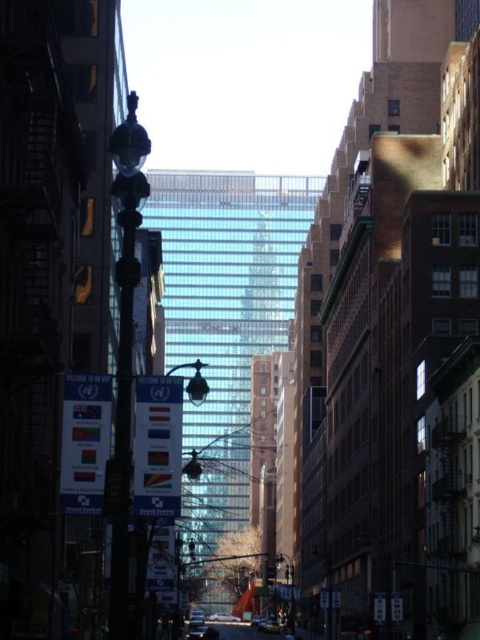
You are a delivery driver needing to park your truck, which is 6 meters long, between the black glass lamp post at center and the silver metallic sedan at center. Is there enough space for your truck?

The distance between the black glass lamp post at center and the silver metallic sedan at center is 55.20 meters. Since your truck is only 6 meters long, there is more than enough space to park between them.